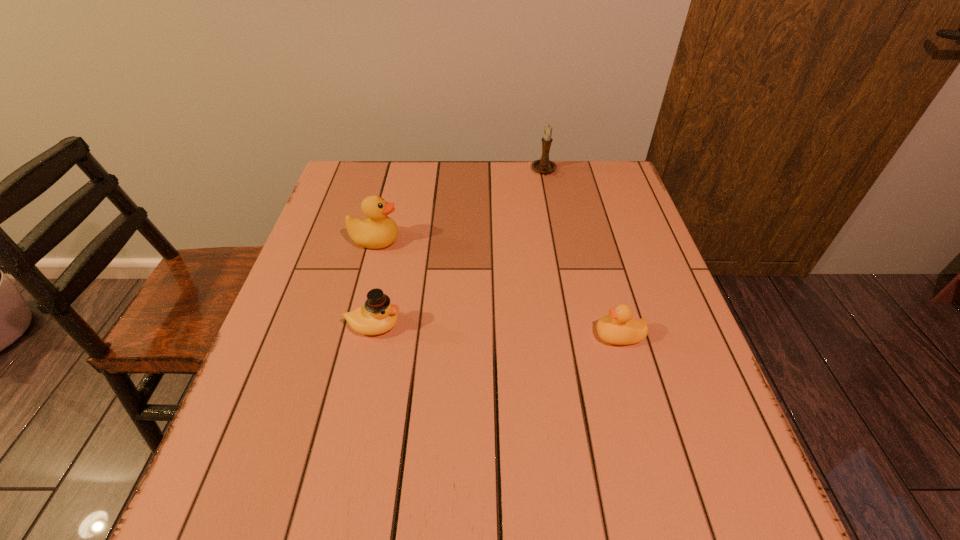
You are a GUI agent. You are given a task and a screenshot of the screen. Output one action in this format:
    pyautogui.click(x=<x>, y=<y>)
    Task: Click on the free space between the third object from left to right and the tallest duck
    Image resolution: width=960 pixels, height=540 pixels.
    Given the screenshot: What is the action you would take?
    pyautogui.click(x=460, y=206)

At what (x,y) coordinates should I click in order to perform the action: click on free spot between the rightmost duck and the farthest object. Please return your answer as a coordinate pair (x, y). This screenshot has width=960, height=540. Looking at the image, I should click on (582, 253).

Image resolution: width=960 pixels, height=540 pixels. I want to click on object that is the third nearest to the candle holder, so click(378, 315).

At what (x,y) coordinates should I click in order to perform the action: click on object that is the closest to the farthest duck. Please return your answer as a coordinate pair (x, y). This screenshot has width=960, height=540. Looking at the image, I should click on (378, 315).

Where is `the second closest duck to the rightmost object`? The width and height of the screenshot is (960, 540). the second closest duck to the rightmost object is located at coordinates (378, 231).

This screenshot has width=960, height=540. Find the location of `duck that is the second closest to the farthest object`. duck that is the second closest to the farthest object is located at coordinates (619, 328).

Locate an element on the screen. vacant point that satisfies the following two spatial constraints: 1. on the side of the farthest object with the handle; 2. at the beak of the farthest duck is located at coordinates (558, 240).

I want to click on free space that satisfies the following two spatial constraints: 1. on the side of the third object from left to right with the handle; 2. at the beak of the second farthest object, so click(558, 240).

Find the location of a particular element. Image resolution: width=960 pixels, height=540 pixels. vacant space that satisfies the following two spatial constraints: 1. on the side of the candle holder with the handle; 2. at the beak of the farthest duck is located at coordinates (558, 240).

The width and height of the screenshot is (960, 540). I want to click on vacant region that satisfies the following two spatial constraints: 1. on the side of the second object from right to left with the handle; 2. at the beak of the tallest duck, so click(558, 240).